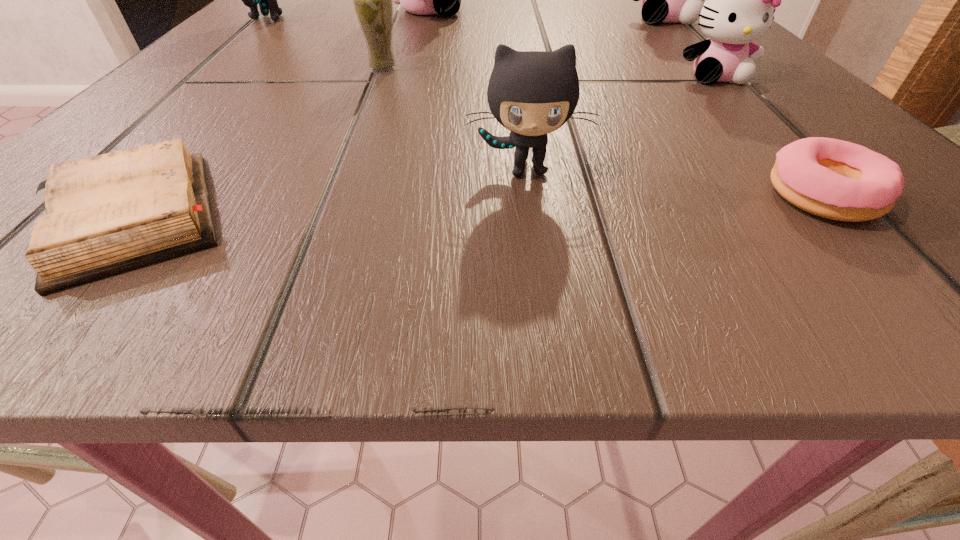
You are a GUI agent. You are given a task and a screenshot of the screen. Output one action in this format:
    pyautogui.click(x=<x>, y=<y>)
    Task: Click on the free region located on the front-facing side of the second smallest white kitten
    
    Given the screenshot: What is the action you would take?
    pyautogui.click(x=779, y=141)

Image resolution: width=960 pixels, height=540 pixels. I want to click on vacant region located 0.130m on the front-facing side of the left gray kitten, so click(x=372, y=19).

Locate an element on the screen. This screenshot has width=960, height=540. free space located on the back of the yellow straw for drinking is located at coordinates (402, 19).

Where is `free space located 0.320m on the front-facing side of the smallest white kitten`? This screenshot has width=960, height=540. free space located 0.320m on the front-facing side of the smallest white kitten is located at coordinates (895, 271).

This screenshot has width=960, height=540. Find the location of `free space located on the front-facing side of the smaller gray kitten`. free space located on the front-facing side of the smaller gray kitten is located at coordinates (538, 247).

Locate an element on the screen. This screenshot has height=540, width=960. free region located 0.170m on the left of the doughnut is located at coordinates (576, 197).

Locate an element on the screen. object present at the near edge is located at coordinates (834, 179).

The width and height of the screenshot is (960, 540). Identify the location of object located at the left edge. (267, 0).

Identify the location of doughnut positioned at the right edge. The height and width of the screenshot is (540, 960). (834, 179).

The width and height of the screenshot is (960, 540). What are the coordinates of `object at the far left corner` in the screenshot? It's located at (267, 0).